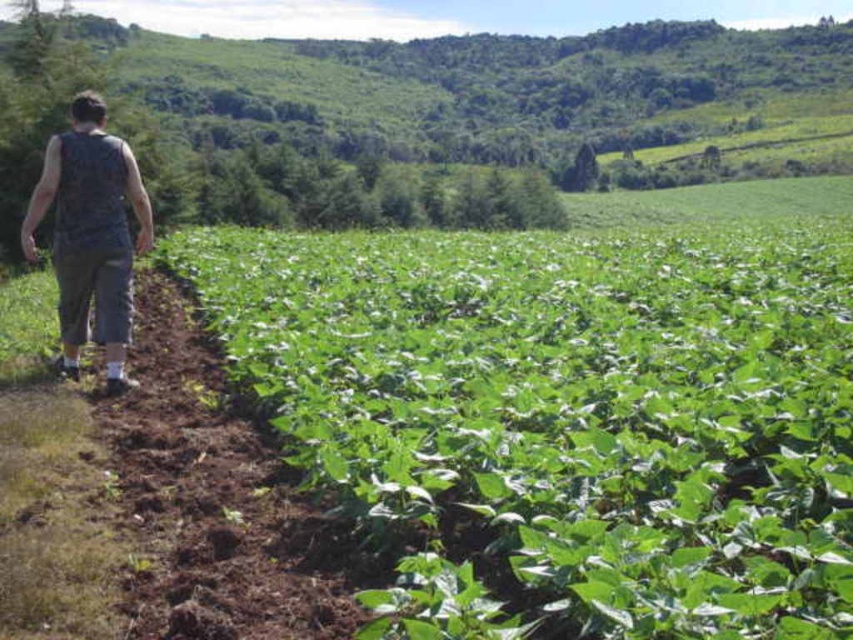
Question: Which object appears closest to the camera in this image?

Choices:
 (A) green leafy plant at center
 (B) dark gray sleeveless shirt at left

Answer: (A)

Question: Based on their relative distances, which object is nearer to the dark gray sleeveless shirt at left?

Choices:
 (A) green leafy hillside at upper left
 (B) green leafy plant at center

Answer: (B)

Question: Does green leafy plant at center appear on the right side of dark gray sleeveless shirt at left?

Choices:
 (A) no
 (B) yes

Answer: (B)

Question: Does green leafy plant at center appear over green leafy hillside at upper left?

Choices:
 (A) yes
 (B) no

Answer: (B)

Question: Estimate the real-world distances between objects in this image. Which object is closer to the dark gray sleeveless shirt at left?

Choices:
 (A) green leafy plant at center
 (B) green leafy hillside at upper left

Answer: (A)

Question: Is green leafy hillside at upper left smaller than dark gray sleeveless shirt at left?

Choices:
 (A) yes
 (B) no

Answer: (B)